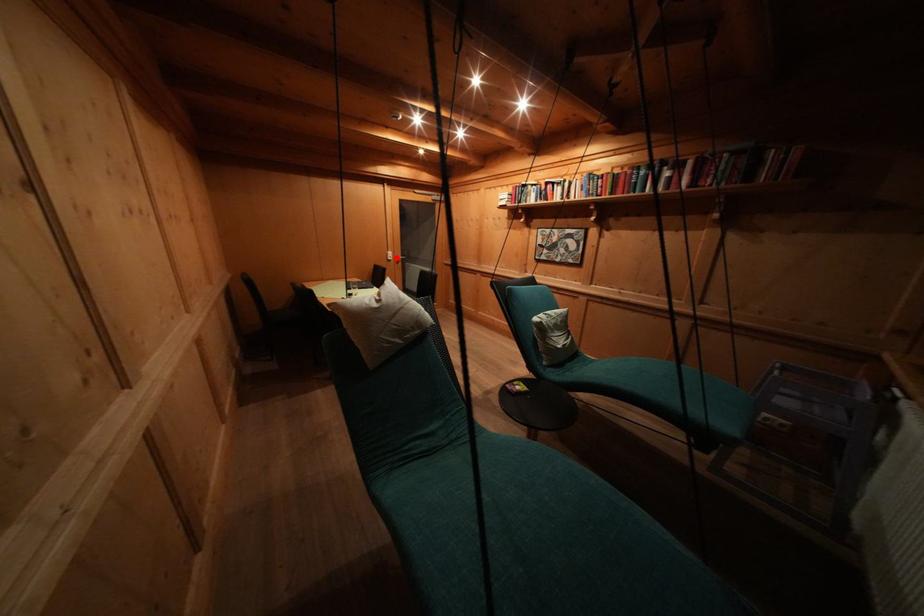
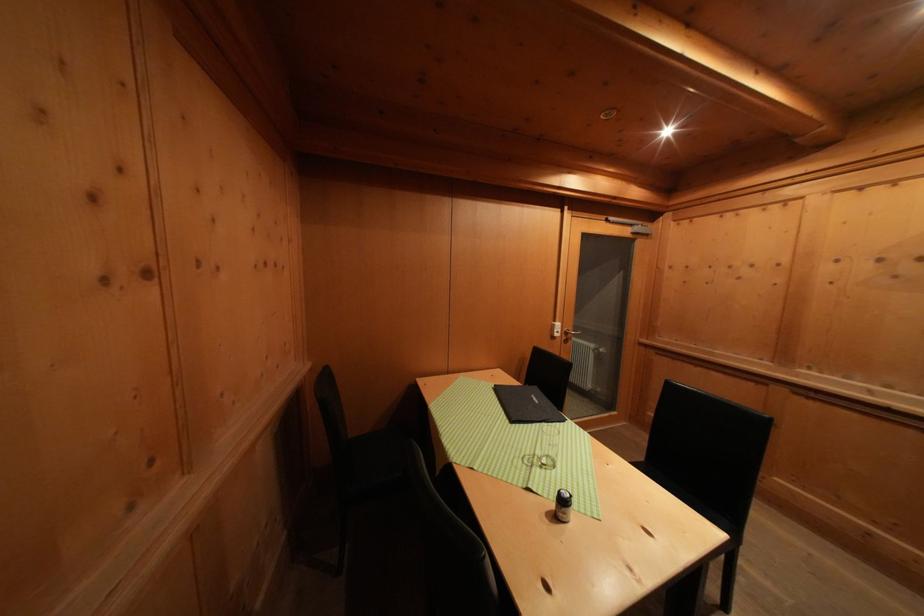
Question: I am providing you with two images of the same scene from different viewpoints. Given a red point in image1, look at the same physical point in image2. Is it:

Choices:
 (A) Closer to the viewpoint
 (B) Farther from the viewpoint

Answer: (B)